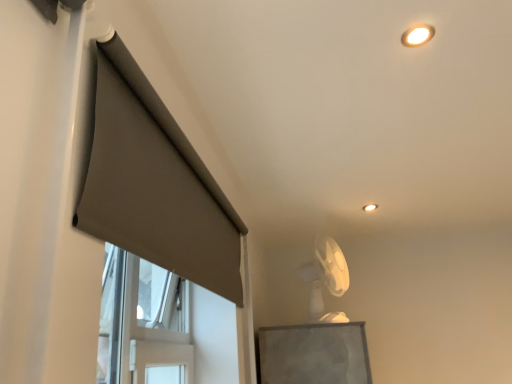
Question: Is white plastic fan at upper center spatially inside matte white ceiling light at upper center, or outside of it?

Choices:
 (A) outside
 (B) inside

Answer: (A)

Question: In terms of size, does white plastic fan at upper center appear bigger or smaller than matte white ceiling light at upper center?

Choices:
 (A) big
 (B) small

Answer: (A)

Question: Estimate the real-world distances between objects in this image. Which object is farther from the matte gray curtain at left?

Choices:
 (A) matte white ceiling light at upper center
 (B) white plastic fan at upper center

Answer: (A)

Question: Estimate the real-world distances between objects in this image. Which object is farther from the white plastic fan at upper center?

Choices:
 (A) matte white ceiling light at upper center
 (B) matte gray curtain at left

Answer: (B)